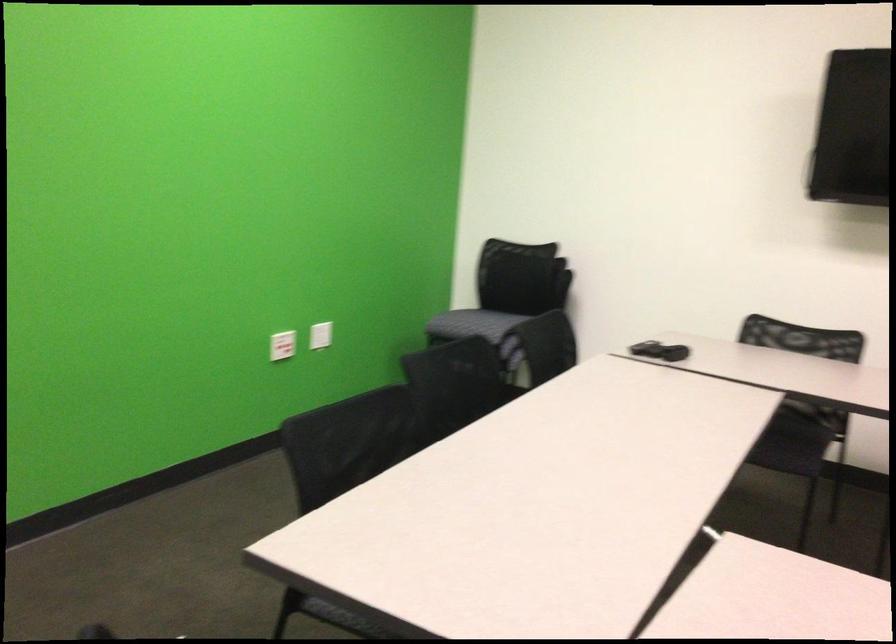
The first image is from the beginning of the video and the second image is from the end. How did the camera likely rotate when shooting the video?

The camera rotated toward left-down.